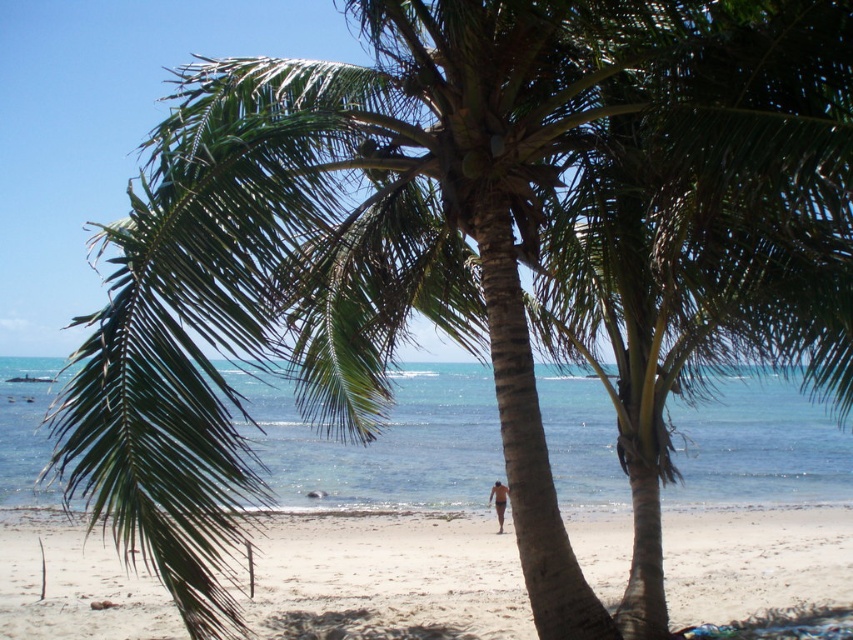
You are standing on the sandy beach at lower center and want to reach the clear blue water at center. Which direction should you move to get there?

Since the sandy beach at lower center is lower in height compared to the clear blue water at center, you should move towards the direction of the clear blue water at center to reach it.

You are standing on the sandy beach at lower center and want to reach the clear blue water at center. Which direction should you move to get there?

You should move upward because the sandy beach at lower center is below the clear blue water at center, so moving upward towards the water will get you there.